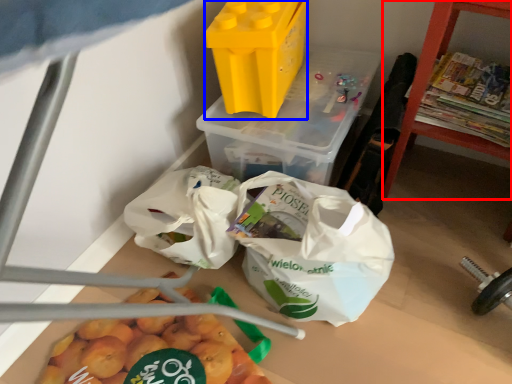
Question: Which of the following is the closest to the observer, furniture (highlighted by a red box) or yoghurt (highlighted by a blue box)?

Choices:
 (A) furniture
 (B) yoghurt

Answer: (A)